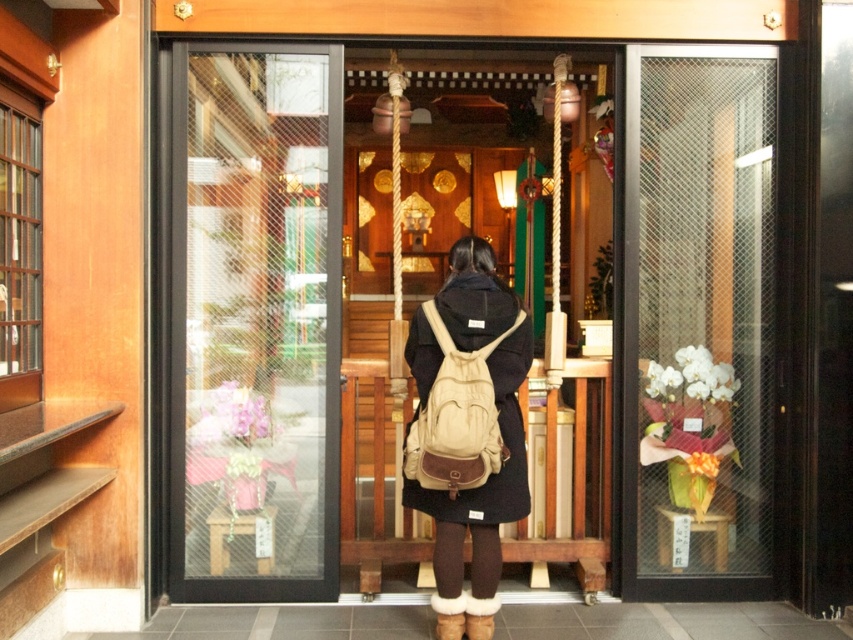
Looking at this image, between transparent glass door at center and beige canvas backpack at center, which one is positioned higher?

Positioned higher is transparent glass door at center.

Which of these two, transparent glass door at center or beige canvas backpack at center, stands shorter?

beige canvas backpack at center

Is point (321, 138) positioned behind point (482, 419)?

Yes, point (321, 138) is behind point (482, 419).

Locate an element on the screen. Image resolution: width=853 pixels, height=640 pixels. transparent glass door at center is located at coordinates (254, 321).

How much distance is there between matte black elevator at center and beige canvas backpack at center?

A distance of 1.12 meters exists between matte black elevator at center and beige canvas backpack at center.

Is matte black elevator at center positioned behind beige canvas backpack at center?

That is True.

Who is more forward, (x=727, y=221) or (x=450, y=448)?

Positioned in front is point (x=450, y=448).

This screenshot has width=853, height=640. What are the coordinates of `matte black elevator at center` in the screenshot? It's located at (691, 298).

Is point (663, 480) less distant than point (245, 554)?

No, (663, 480) is behind (245, 554).

Does matte black elevator at center lie in front of transparent glass door at center?

No, it is not.

Which is behind, point (589, 464) or point (259, 387)?

Point (589, 464)

This screenshot has height=640, width=853. What are the coordinates of `matte black elevator at center` in the screenshot? It's located at (691, 298).